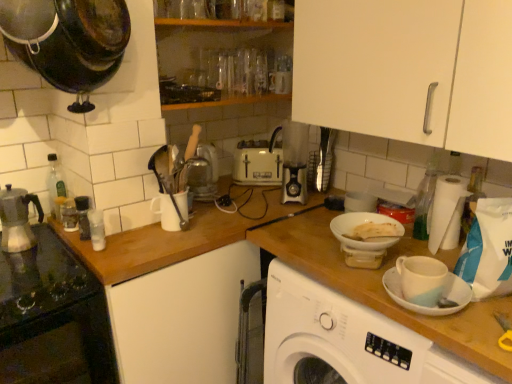
This screenshot has height=384, width=512. Find the location of `white matte saucer at right`. white matte saucer at right is located at coordinates click(x=442, y=294).

Find the location of a particular element. black plastic grinder at left, placed as the 3th bottle when sorted from right to left is located at coordinates (83, 216).

Identify the location of white matte bottle at left, which is counted as the second bottle, starting from the right. (97, 229).

Describe the element at coordinates (425, 199) in the screenshot. Image resolution: width=512 pixels, height=384 pixels. I see `clear plastic bottle at right, the 1th bottle from the right` at that location.

This screenshot has height=384, width=512. What are the coordinates of `white matte saucer at right` in the screenshot? It's located at (442, 294).

Which of these two, black glass cooktop at left or clear glass bottle at left, which is counted as the first bottle, starting from the left, stands shorter?

clear glass bottle at left, which is counted as the first bottle, starting from the left, is shorter.

From a real-world perspective, which is physically below, black glass cooktop at left or clear glass bottle at left, arranged as the 4th bottle when viewed from the right?

black glass cooktop at left, from a real-world perspective.

The height and width of the screenshot is (384, 512). Identify the location of home appliance below the clear glass bottle at left, which is counted as the first bottle, starting from the left (from a real-world perspective). (53, 318).

From the image's perspective, is black glass cooktop at left above clear glass bottle at left, arranged as the 4th bottle when viewed from the right?

No, from the image's perspective, black glass cooktop at left is not on top of clear glass bottle at left, arranged as the 4th bottle when viewed from the right.

Would you say clear glass jar at left contains white matte bottle at left, which is counted as the second bottle, starting from the right?

No, white matte bottle at left, which is counted as the second bottle, starting from the right, is not inside clear glass jar at left.

Is point (71, 208) closer or farther from the camera than point (92, 213)?

Point (71, 208).

Considering the sizes of objects clear glass jar at left and white matte bottle at left, the third bottle positioned from the left, in the image provided, who is taller, clear glass jar at left or white matte bottle at left, the third bottle positioned from the left,?

white matte bottle at left, the third bottle positioned from the left, is taller.

Is clear glass jar at left oriented towards white matte bottle at left, which is counted as the second bottle, starting from the right?

No, clear glass jar at left is not turned towards white matte bottle at left, which is counted as the second bottle, starting from the right.

How different are the orientations of white matte bowl at center and black plastic grinder at left, placed as the 3th bottle when sorted from right to left, in degrees?

They differ by 9.02 degrees in their facing directions.

From a real-world perspective, is white matte bowl at center above or below black plastic grinder at left, positioned as the 2th bottle in left-to-right order?

white matte bowl at center is above black plastic grinder at left, positioned as the 2th bottle in left-to-right order.

Could you tell me if white matte bowl at center is facing black plastic grinder at left, placed as the 3th bottle when sorted from right to left?

No, white matte bowl at center is not aimed at black plastic grinder at left, placed as the 3th bottle when sorted from right to left.

Which is farther from the camera, [347,238] or [82,210]?

The point [82,210] is more distant.

From a real-world perspective, is metallic silver espresso maker at left located higher than translucent glass coffee machine at center?

No, from a real-world perspective, metallic silver espresso maker at left is not above translucent glass coffee machine at center.

Looking at this image, between metallic silver espresso maker at left and translucent glass coffee machine at center, which one has more height?

Standing taller between the two is translucent glass coffee machine at center.

Is metallic silver espresso maker at left at the left side of translucent glass coffee machine at center?

Yes.

Consider the image. Is there a large distance between metallic silver espresso maker at left and translucent glass coffee machine at center?

metallic silver espresso maker at left is near translucent glass coffee machine at center, not far away.

Which object is further away from the camera, metallic silver espresso maker at left or white matte bottle at left, which is counted as the second bottle, starting from the right?

Positioned behind is white matte bottle at left, which is counted as the second bottle, starting from the right.

Who is taller, metallic silver espresso maker at left or white matte bottle at left, which is counted as the second bottle, starting from the right?

Standing taller between the two is metallic silver espresso maker at left.

From a real-world perspective, is metallic silver espresso maker at left physically above white matte bottle at left, which is counted as the second bottle, starting from the right?

Yes, from a real-world perspective, metallic silver espresso maker at left is above white matte bottle at left, which is counted as the second bottle, starting from the right.

From the picture: Could you measure the distance between metallic silver espresso maker at left and white matte bottle at left, the third bottle positioned from the left?

A distance of 26.88 centimeters exists between metallic silver espresso maker at left and white matte bottle at left, the third bottle positioned from the left.

Is white matte saucer at right next to black plastic grinder at left, positioned as the 2th bottle in left-to-right order?

white matte saucer at right and black plastic grinder at left, positioned as the 2th bottle in left-to-right order, are clearly separated.

Is point (444, 297) less distant than point (84, 214)?

Yes, it is in front of point (84, 214).

From a real-world perspective, is white matte saucer at right physically above black plastic grinder at left, placed as the 3th bottle when sorted from right to left?

Incorrect, from a real-world perspective, white matte saucer at right is lower than black plastic grinder at left, placed as the 3th bottle when sorted from right to left.

Is clear plastic bottle at right, which is the fourth bottle in left-to-right order, with white matte saucer at right?

No, clear plastic bottle at right, which is the fourth bottle in left-to-right order, is not next to white matte saucer at right.

Consider the image. Would you say clear plastic bottle at right, the 1th bottle from the right, is outside white matte saucer at right?

clear plastic bottle at right, the 1th bottle from the right, lies outside white matte saucer at right's area.

Looking at this image, measure the distance between clear plastic bottle at right, the 1th bottle from the right, and white matte saucer at right.

clear plastic bottle at right, the 1th bottle from the right, and white matte saucer at right are 40.99 centimeters apart from each other.

From the image's perspective, is clear plastic bottle at right, which is the fourth bottle in left-to-right order, beneath white matte saucer at right?

Incorrect, from the image's perspective, clear plastic bottle at right, which is the fourth bottle in left-to-right order, is higher than white matte saucer at right.

Locate an element on the screen. bottle on the left of black glass cooktop at left is located at coordinates (55, 187).

The height and width of the screenshot is (384, 512). What are the coordinates of `bottle located below the clear glass jar at left (from the image's perspective)` in the screenshot? It's located at (97, 229).

Which object lies nearer to the anchor point wooden at left, clear glass bottle at left, arranged as the 4th bottle when viewed from the right, or white matte bowl at center?

Among the two, white matte bowl at center is located nearer to wooden at left.

Estimate the real-world distances between objects in this image. Which object is closer to black plastic grinder at left, positioned as the 2th bottle in left-to-right order, clear plastic bottle at right, the 1th bottle from the right, or wooden at left?

wooden at left lies closer to black plastic grinder at left, positioned as the 2th bottle in left-to-right order, than the other object.

Based on their spatial positions, is black plastic grinder at left, placed as the 3th bottle when sorted from right to left, or translucent glass coffee machine at center further from clear plastic bottle at right, which is the fourth bottle in left-to-right order?

black plastic grinder at left, placed as the 3th bottle when sorted from right to left, is further to clear plastic bottle at right, which is the fourth bottle in left-to-right order.

From the picture: Considering their positions, is white matte cabinet at upper right positioned closer to clear glass jar at left than translucent glass coffee machine at center?

translucent glass coffee machine at center is closer to clear glass jar at left.

When comparing their distances from white matte cabinet at upper right, does black plastic grinder at left, placed as the 3th bottle when sorted from right to left, or white matte saucer at right seem further?

black plastic grinder at left, placed as the 3th bottle when sorted from right to left, is further to white matte cabinet at upper right.

Which object lies further to the anchor point metallic silver espresso maker at left, clear glass jar at left or clear plastic bottle at right, which is the fourth bottle in left-to-right order?

clear plastic bottle at right, which is the fourth bottle in left-to-right order, is positioned further to the anchor metallic silver espresso maker at left.

From the image, which object appears to be nearer to clear plastic bottle at right, which is the fourth bottle in left-to-right order, clear glass bottle at left, arranged as the 4th bottle when viewed from the right, or metallic silver espresso maker at left?

clear glass bottle at left, arranged as the 4th bottle when viewed from the right, is closer to clear plastic bottle at right, which is the fourth bottle in left-to-right order.

Which object lies nearer to the anchor point white matte cabinet at upper right, black glass cooktop at left or clear glass bottle at left, which is counted as the first bottle, starting from the left?

Based on the image, black glass cooktop at left appears to be nearer to white matte cabinet at upper right.

At what (x,y) coordinates should I click in order to perform the action: click on tableware located between clear glass bottle at left, which is counted as the first bottle, starting from the left, and white matte cabinet at upper right in the left-right direction. Please return your answer as a coordinate pair (x, y). Looking at the image, I should click on (360, 224).

Find the location of a particular element. The height and width of the screenshot is (384, 512). saucer situated between translucent glass coffee machine at center and clear plastic bottle at right, the 1th bottle from the right, from left to right is located at coordinates (442, 294).

Locate an element on the screen. Image resolution: width=512 pixels, height=384 pixels. bottle between clear glass jar at left and black glass cooktop at left in the vertical direction is located at coordinates (97, 229).

I want to click on home appliance between clear glass bottle at left, which is counted as the first bottle, starting from the left, and white plastic toaster at center, so click(53, 318).